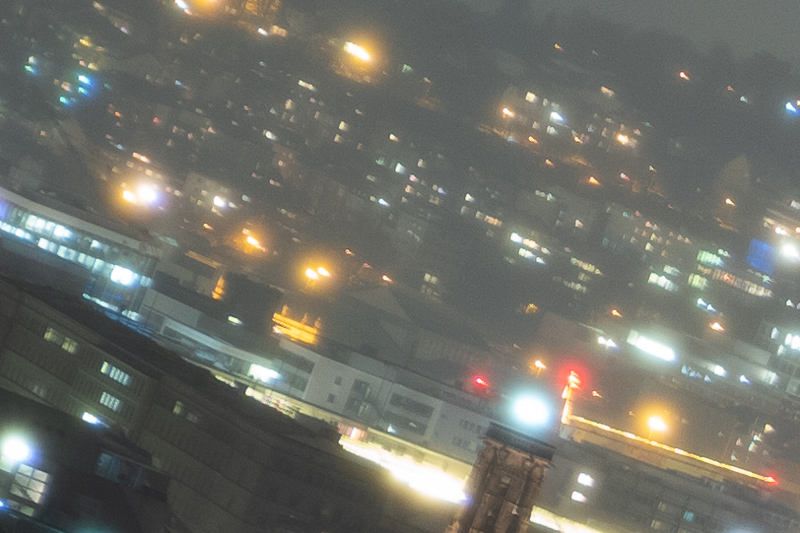
Where is `white light`? Image resolution: width=800 pixels, height=533 pixels. white light is located at coordinates (524, 418), (650, 350), (586, 483), (578, 497), (786, 250), (790, 343).